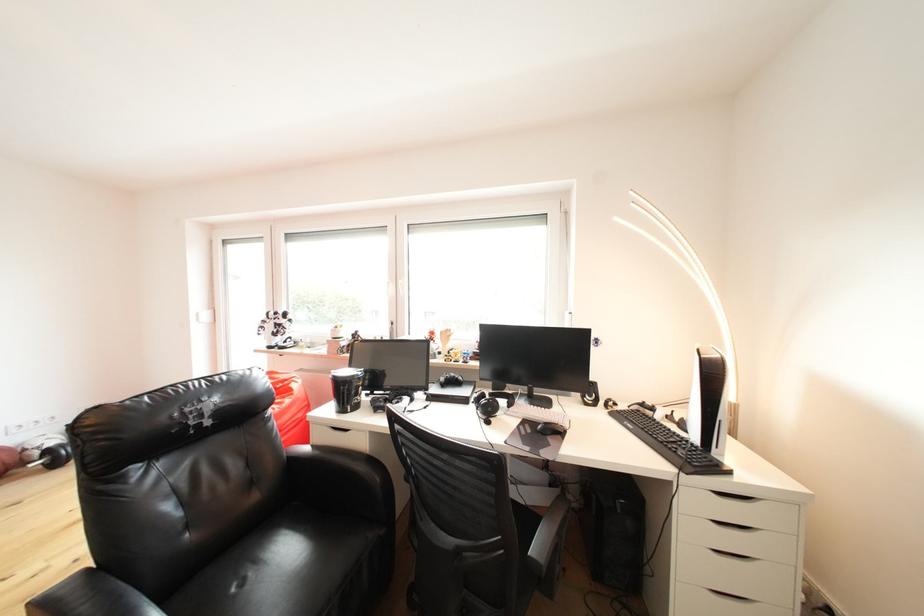
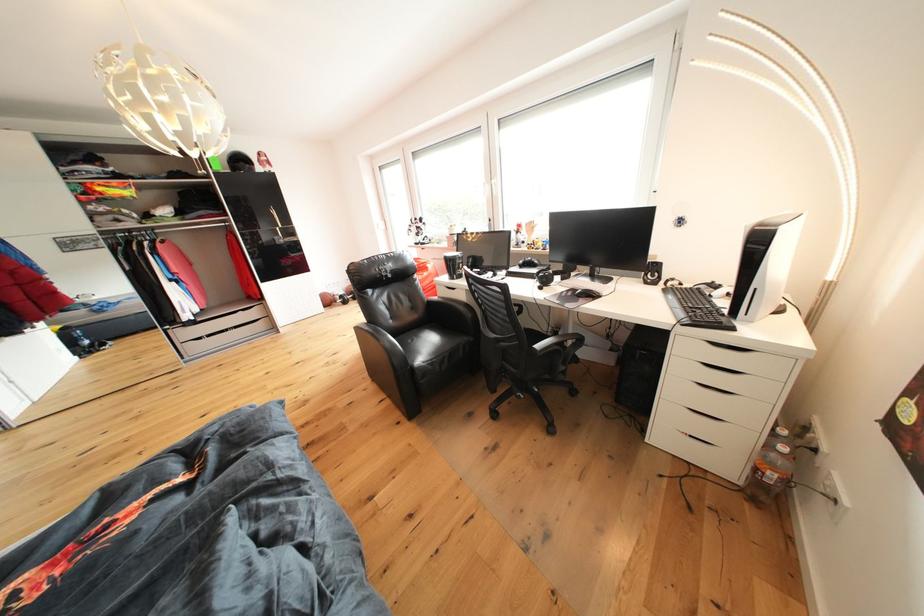
First-person continuous shooting, in which direction is the camera rotating?

The rotation direction of the camera is left-down.